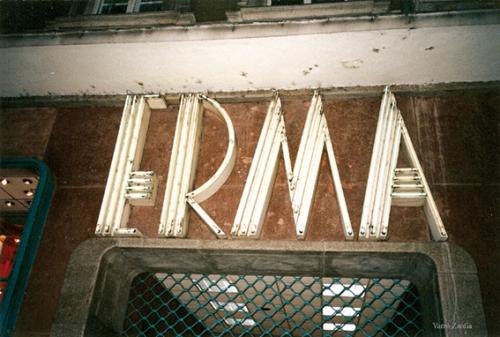
Locate an element on the screen. This screenshot has width=500, height=337. light is located at coordinates point(28,191).